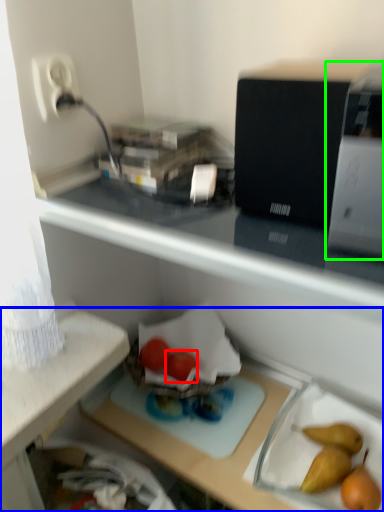
Question: Estimate the real-world distances between objects in this image. Which object is closer to green vegetables (highlighted by a red box), desk (highlighted by a blue box) or appliance (highlighted by a green box)?

Choices:
 (A) desk
 (B) appliance

Answer: (A)